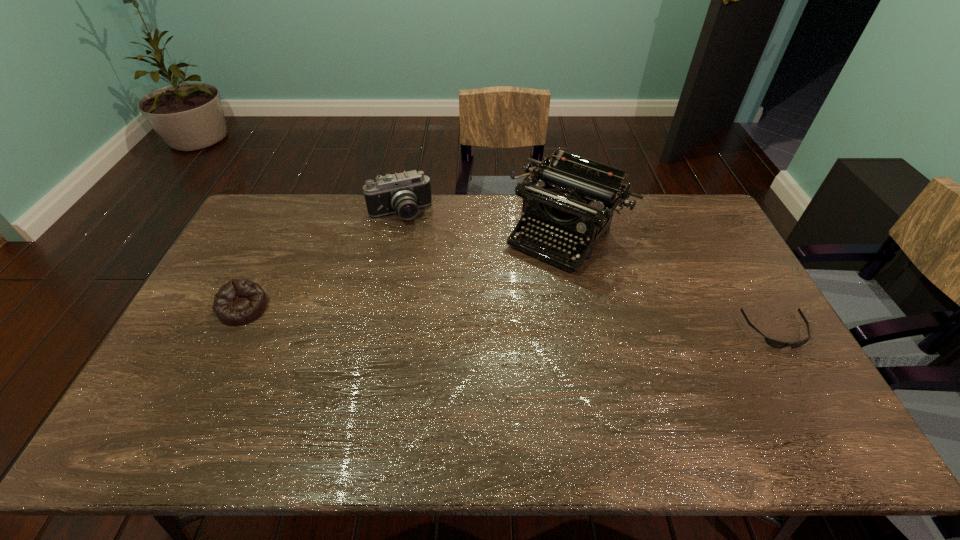
This screenshot has height=540, width=960. Identify the location of free spot between the third shortest object and the tallest object. click(x=484, y=224).

Where is `free space between the second shortest object and the second object from right to left`? Image resolution: width=960 pixels, height=540 pixels. free space between the second shortest object and the second object from right to left is located at coordinates (405, 271).

Where is `blank region between the leftmost object and the typewriter`? blank region between the leftmost object and the typewriter is located at coordinates (405, 271).

Image resolution: width=960 pixels, height=540 pixels. In order to click on vacant region between the shortest object and the third object from left to right in this screenshot , I will do pos(672,282).

Where is `empty space that is in between the tallest object and the shortest object`? This screenshot has height=540, width=960. empty space that is in between the tallest object and the shortest object is located at coordinates pos(672,282).

Identify the location of object that is the second closest to the typewriter. This screenshot has width=960, height=540. pyautogui.click(x=777, y=344).

Find the location of a particular element. Image resolution: width=960 pixels, height=540 pixels. object that ranks as the closest to the rightmost object is located at coordinates (577, 197).

The width and height of the screenshot is (960, 540). What are the coordinates of `vacant position in the image that satisfies the following two spatial constraints: 1. on the back side of the second shortest object; 2. on the left side of the second object from right to left` in the screenshot? It's located at (279, 234).